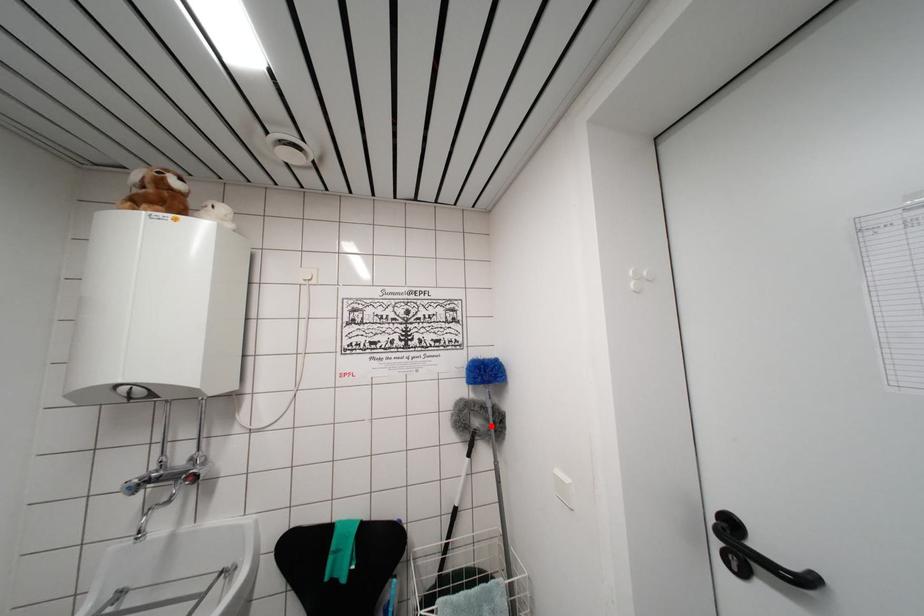
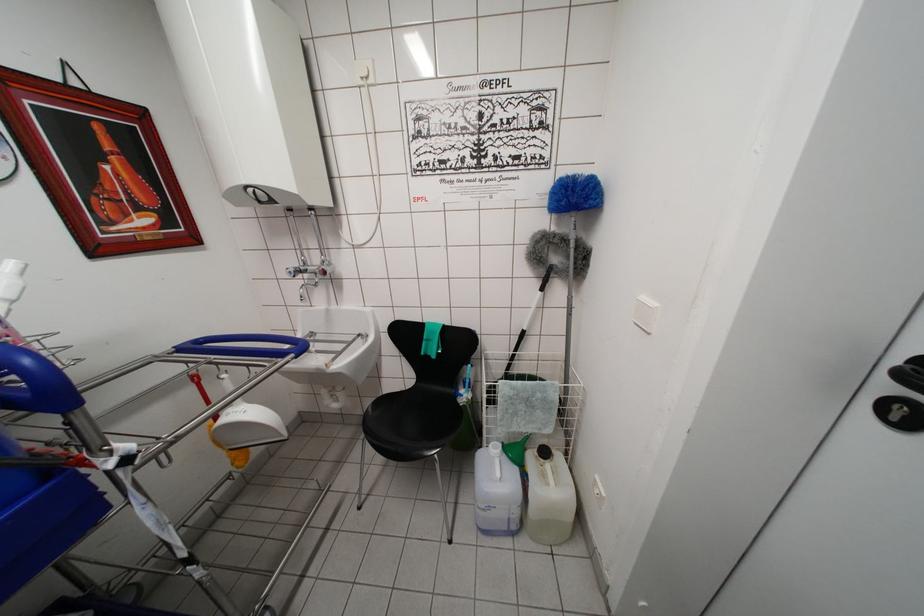
Question: I am providing you with two images of the same scene from different viewpoints. Given a red point in image1, look at the same physical point in image2. Is it:

Choices:
 (A) Closer to the viewpoint
 (B) Farther from the viewpoint

Answer: (A)